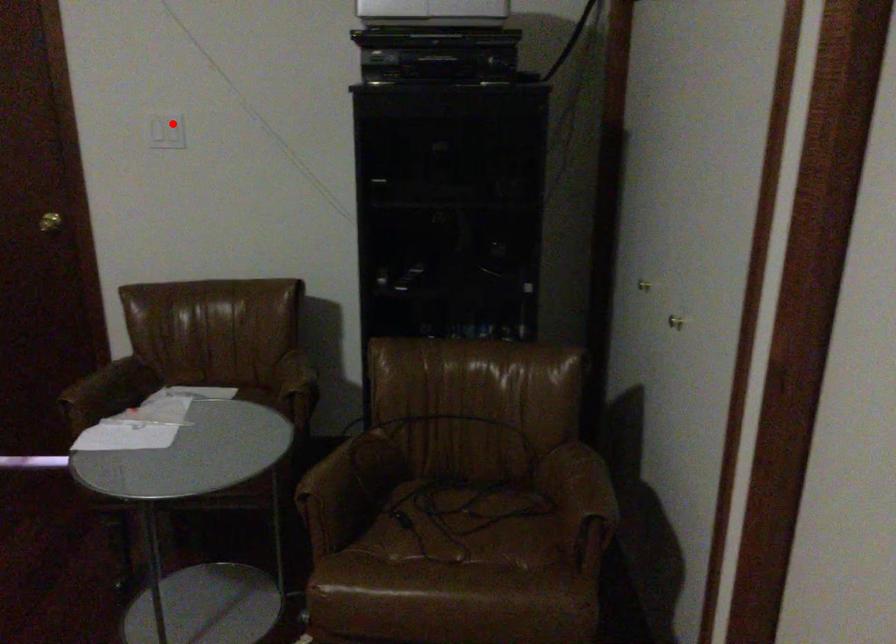
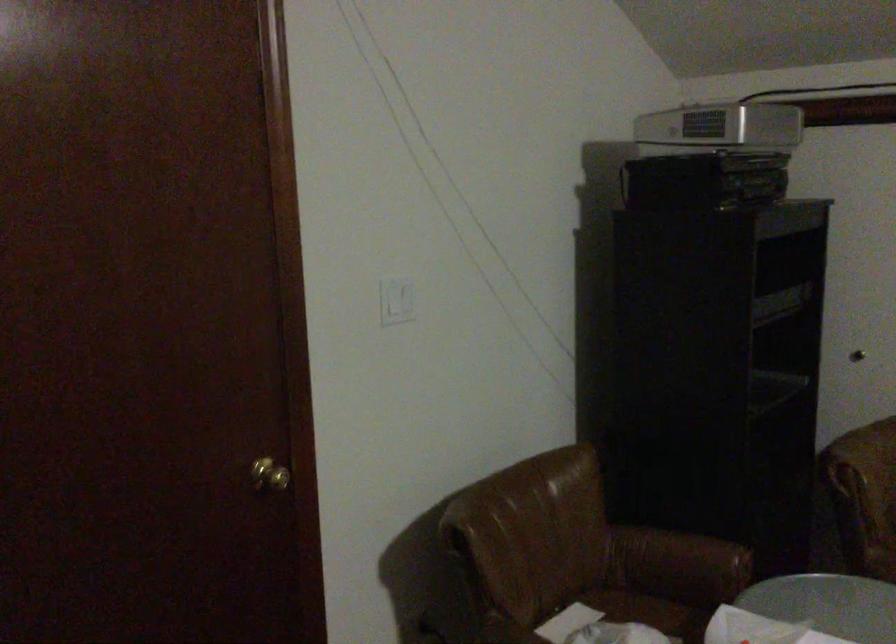
Locate, in the second image, the point that corresponds to the highlighted location in the first image.

(397, 301)